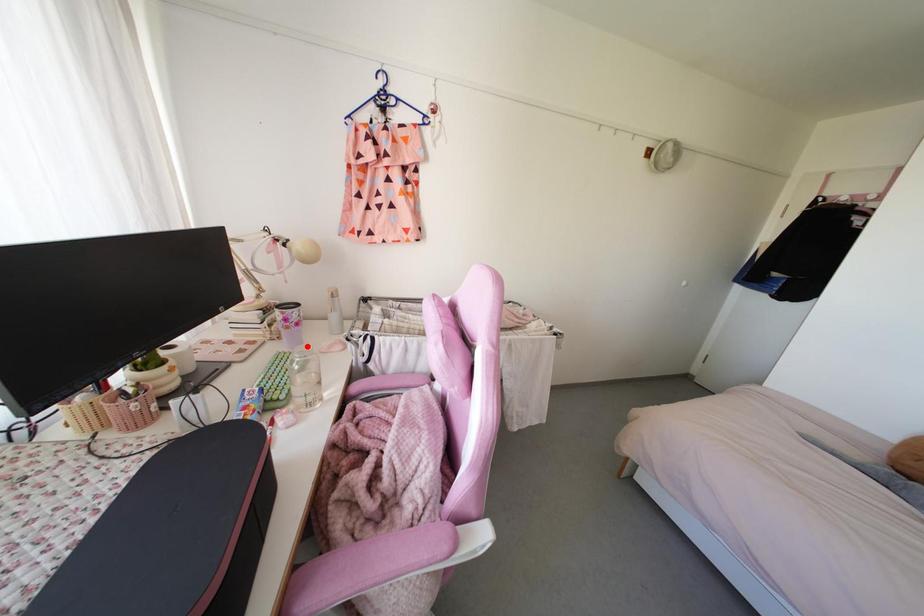
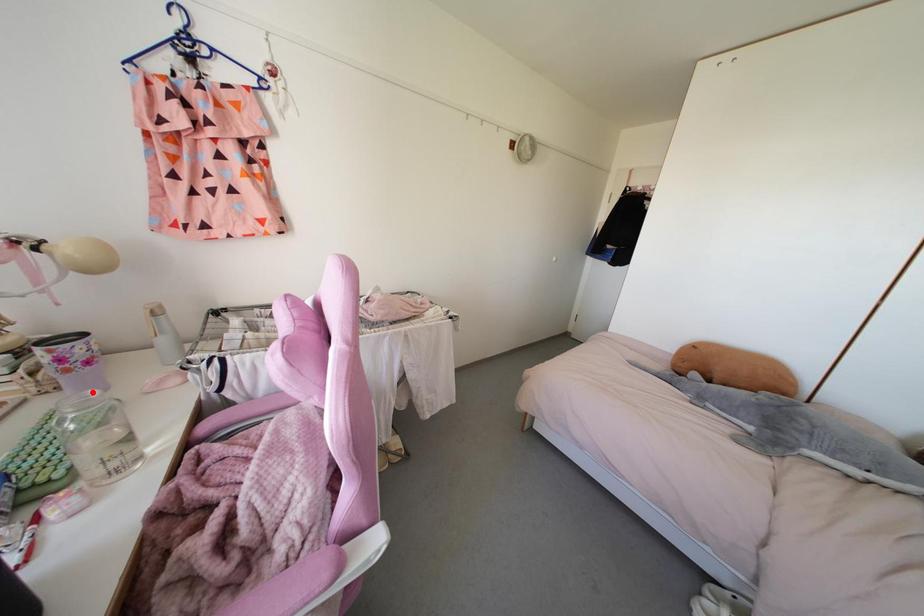
I am providing you with two images of the same scene from different viewpoints. A red point is marked on the first image and another point is marked on the second image. Is the marked point in image1 the same physical position as the marked point in image2?

Yes